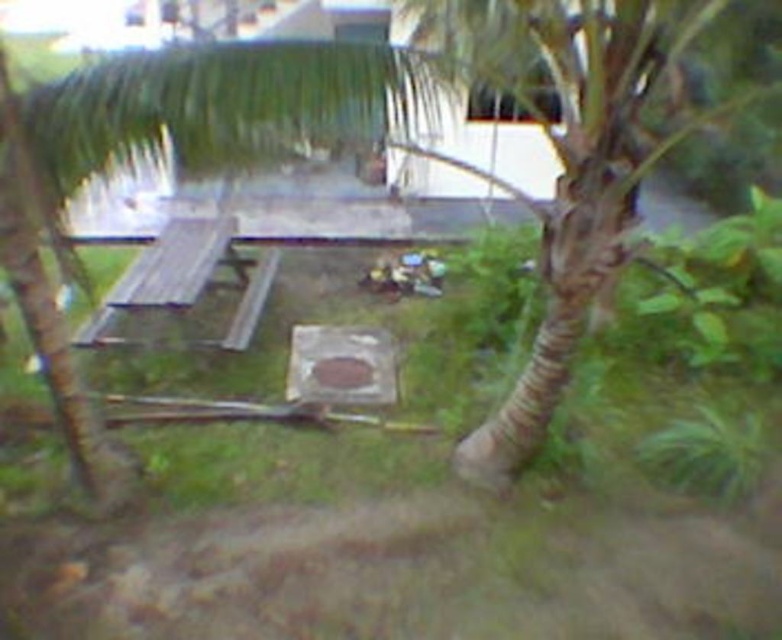
Question: Among these points, which one is farthest from the camera?

Choices:
 (A) (49, 484)
 (B) (149, 257)

Answer: (B)

Question: Which point is closer to the camera?

Choices:
 (A) wooden picnic table at center
 (B) green grass at center

Answer: (B)

Question: Observing the image, what is the correct spatial positioning of green grass at center in reference to wooden picnic table at center?

Choices:
 (A) left
 (B) right

Answer: (B)

Question: Which point is farther to the camera?

Choices:
 (A) (140, 289)
 (B) (198, 477)

Answer: (A)

Question: Does green grass at center have a larger size compared to wooden picnic table at center?

Choices:
 (A) yes
 (B) no

Answer: (A)

Question: Considering the relative positions of green grass at center and wooden picnic table at center in the image provided, where is green grass at center located with respect to wooden picnic table at center?

Choices:
 (A) below
 (B) above

Answer: (A)